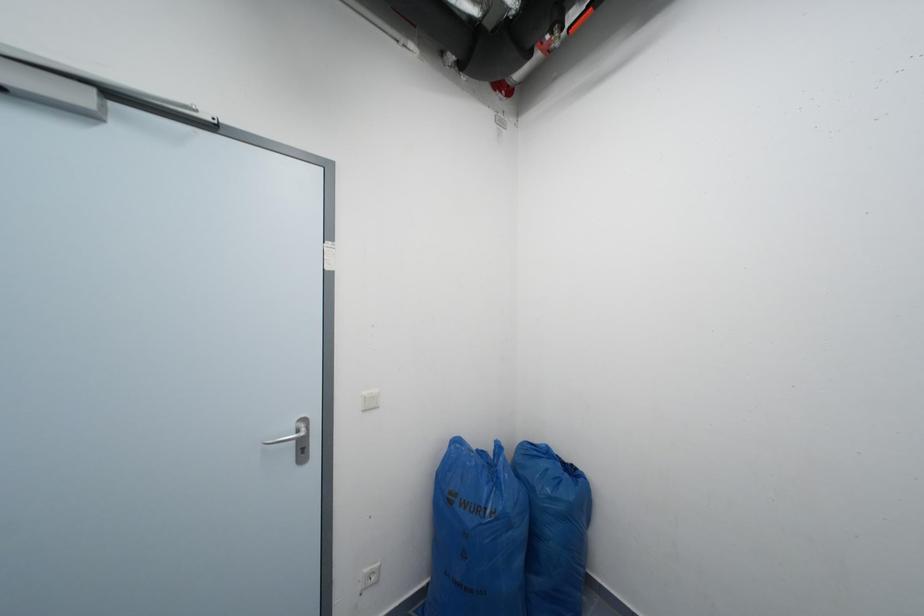
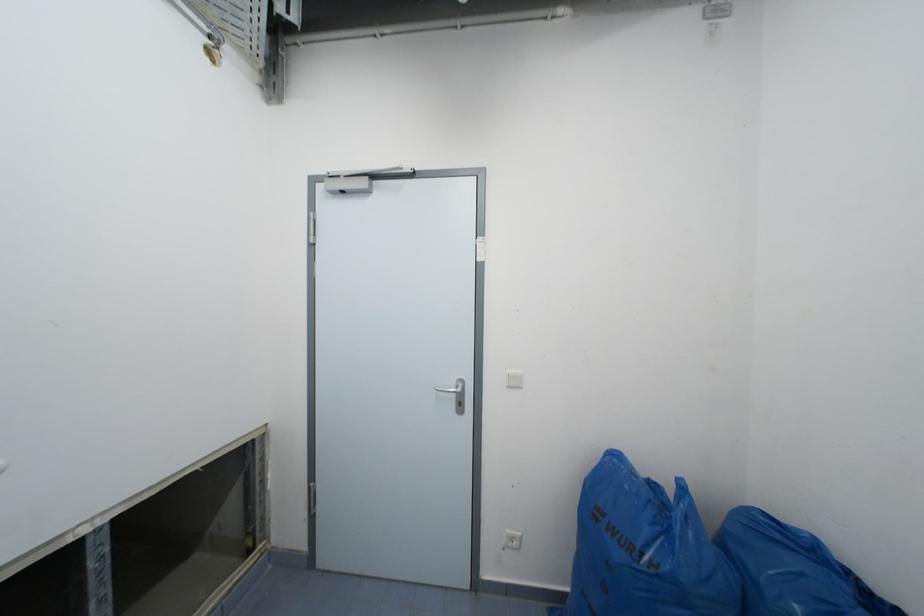
Question: The images are taken continuously from a first-person perspective. In which direction is your viewpoint rotating?

Choices:
 (A) Left
 (B) Right
 (C) Up
 (D) Down

Answer: (A)